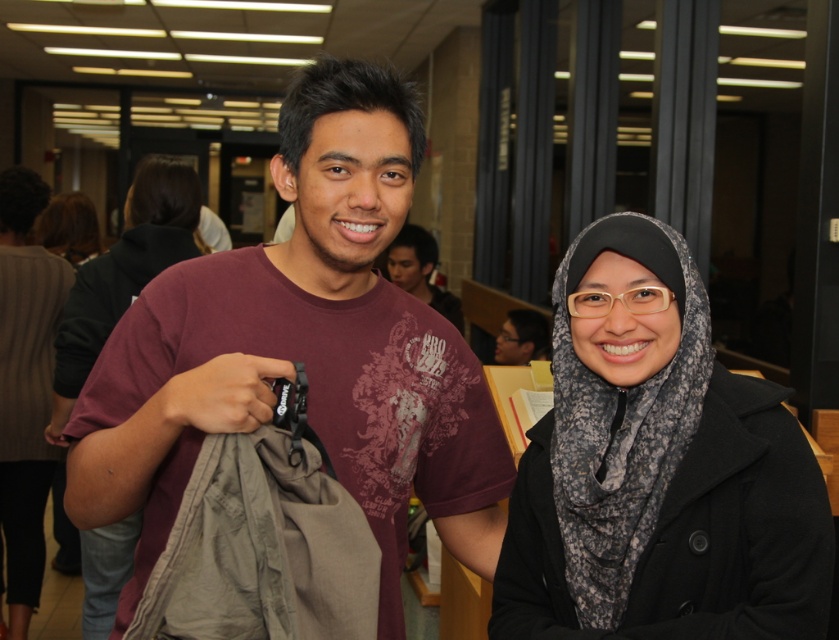
You are a photographer trying to capture both the black textured hijab at center and the matte black hijab at center in a single frame. Which hijab will appear larger in the photo?

The matte black hijab at center will appear larger in the photo because it is bigger than the black textured hijab at center.

You are a photographer setting up for a group photo in the library. You need to ensure that the black textured hijab at center and the matte black hijab at center are both visible in the frame. Based on their widths, which hijab might require more careful framing to avoid being obscured by other elements?

The black textured hijab at center has a lesser width compared to matte black hijab at center, so it might require more careful framing to avoid being obscured by other elements since it is narrower and could be easily missed or covered in the photo.

You are standing at the point marked as point (269, 312) in the image. You want to walk to the door that is 2 meters away from your current position. Is the door within your reach?

The distance between point (269, 312) and the viewer is 1.27 meters. Since the door is 2 meters away from your current position, it is beyond the 1.27 meter distance, so the door is not within your immediate reach.